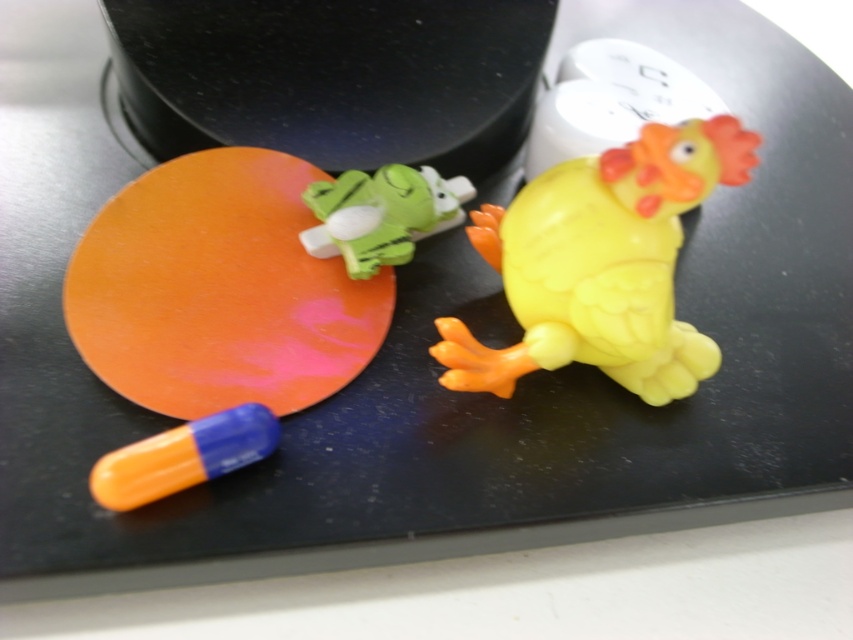
Based on the photo, you are organizing items on a table and need to place a new object between the yellow rubber chicken at center and the orange matte pill at lower left. Where should you place it?

The orange matte pill at lower left is behind the yellow rubber chicken at center, so placing the new object between them would require positioning it in front of the orange matte pill and behind the yellow rubber chicken at center.

You are a child playing with the yellow rubber chicken at center and the green rubber frog at center. If you want to reach the one that is on top, which one should you pick?

The green rubber frog at center is on top of the yellow rubber chicken at center, so you should pick the green rubber frog at center.